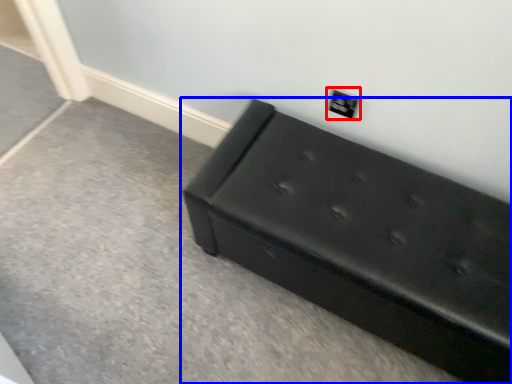
Question: Which point is closer to the camera, electric outlet (highlighted by a red box) or furniture (highlighted by a blue box)?

Choices:
 (A) electric outlet
 (B) furniture

Answer: (B)